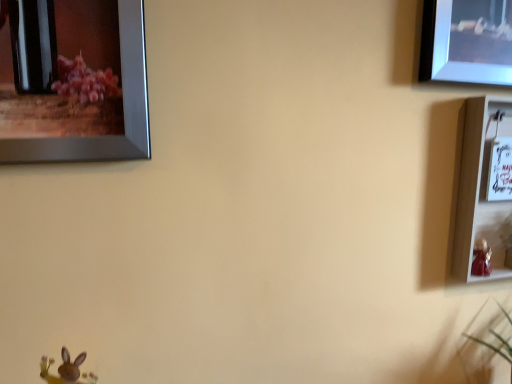
Where is `white glossy picture frame at right`? white glossy picture frame at right is located at coordinates (483, 188).

This screenshot has width=512, height=384. What do you see at coordinates (483, 188) in the screenshot?
I see `white glossy picture frame at right` at bounding box center [483, 188].

Identify the location of white glossy picture frame at right. (x=483, y=188).